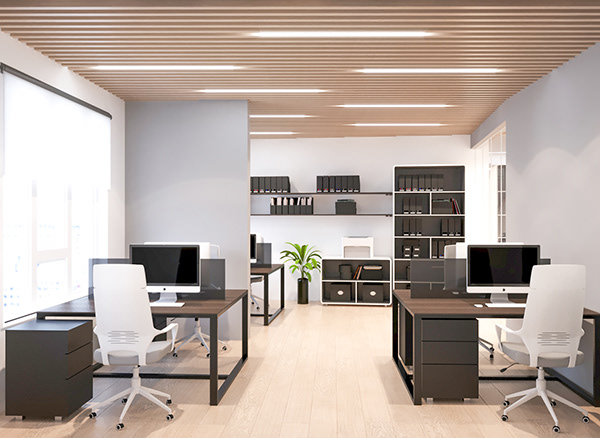
Locate an element on the screen. This screenshot has height=438, width=600. vase is located at coordinates (303, 291).